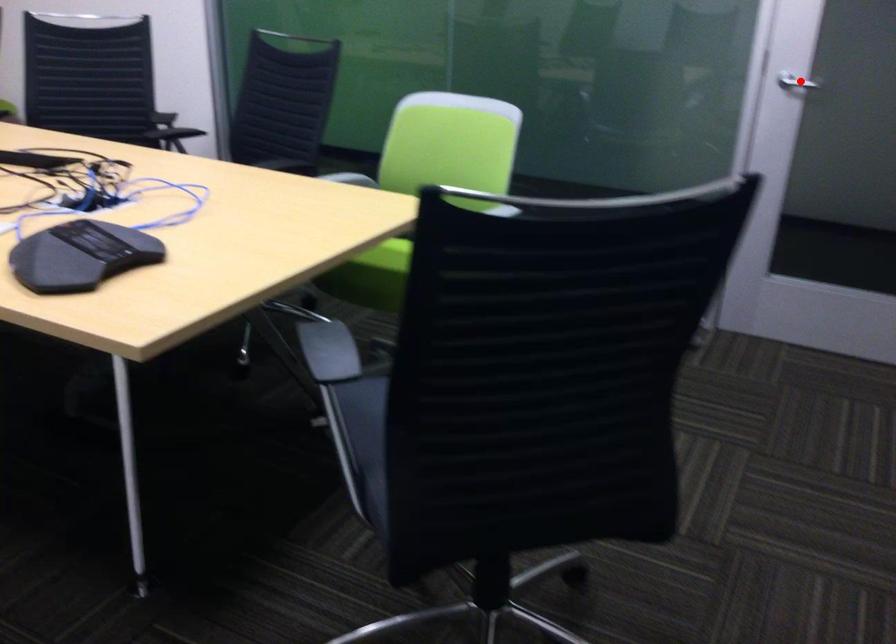
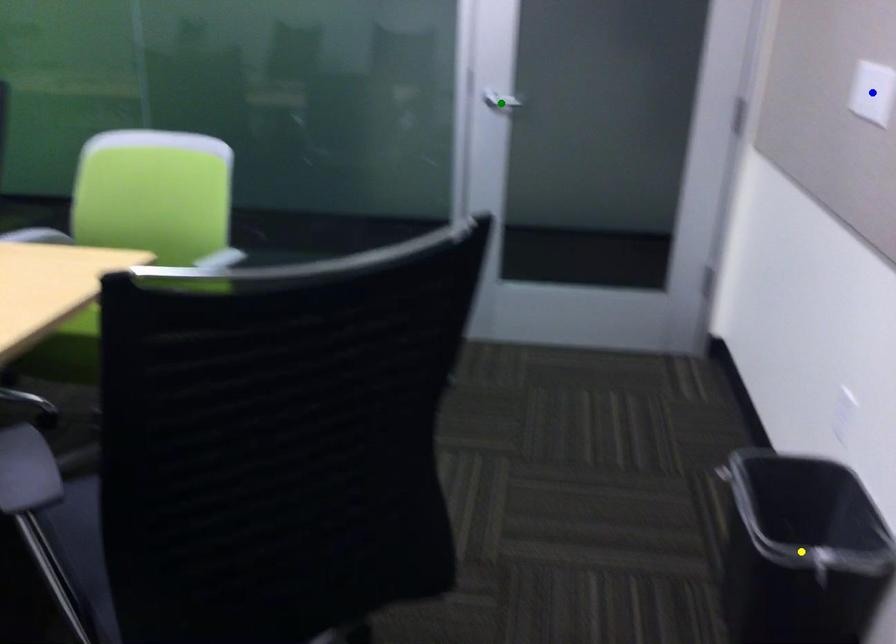
Question: I am providing you with two images of the same scene from different viewpoints. A red point is marked on the first image. You are given multiple points on the second image. Which spot in image 2 lines up with the point in image 1?

Choices:
 (A) blue point
 (B) yellow point
 (C) green point

Answer: (C)